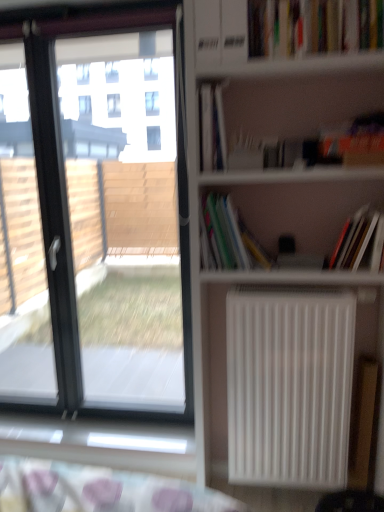
Question: Visually, is white matte radiator at center right positioned to the left or to the right of hardcover book at upper center, which ranks as the second book in top-to-bottom order?

Choices:
 (A) right
 (B) left

Answer: (A)

Question: From the image's perspective, relative to hardcover book at upper center, marked as the 3th book in a bottom-to-top arrangement, is white matte radiator at center right above or below?

Choices:
 (A) above
 (B) below

Answer: (B)

Question: Which is nearer to the hardcover book at upper center, marked as the 3th book in a bottom-to-top arrangement?

Choices:
 (A) hardcover book at upper right, the 4th book in the bottom-to-top sequence
 (B) white matte radiator at center
 (C) multicolored paper at center, which is the 3th book in top-to-bottom order
 (D) hardcover book at right, the first book in the bottom-to-top sequence
 (E) transparent glass window at left

Answer: (C)

Question: Estimate the real-world distances between objects in this image. Which object is closer to the hardcover book at upper center, marked as the 3th book in a bottom-to-top arrangement?

Choices:
 (A) transparent glass window at left
 (B) white matte radiator at center right
 (C) hardcover book at right, the first book in the bottom-to-top sequence
 (D) white matte radiator at center
 (E) hardcover book at upper right, the 4th book in the bottom-to-top sequence

Answer: (D)